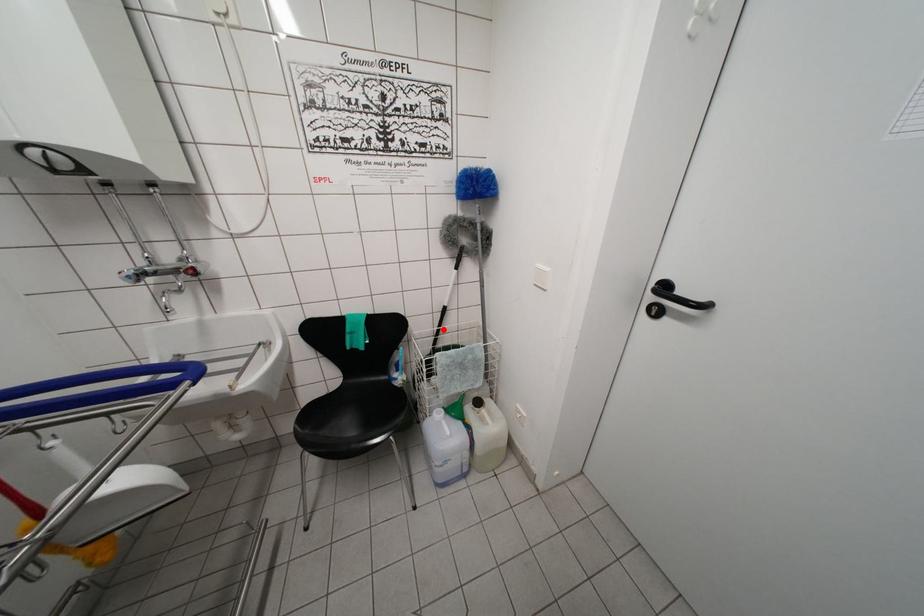
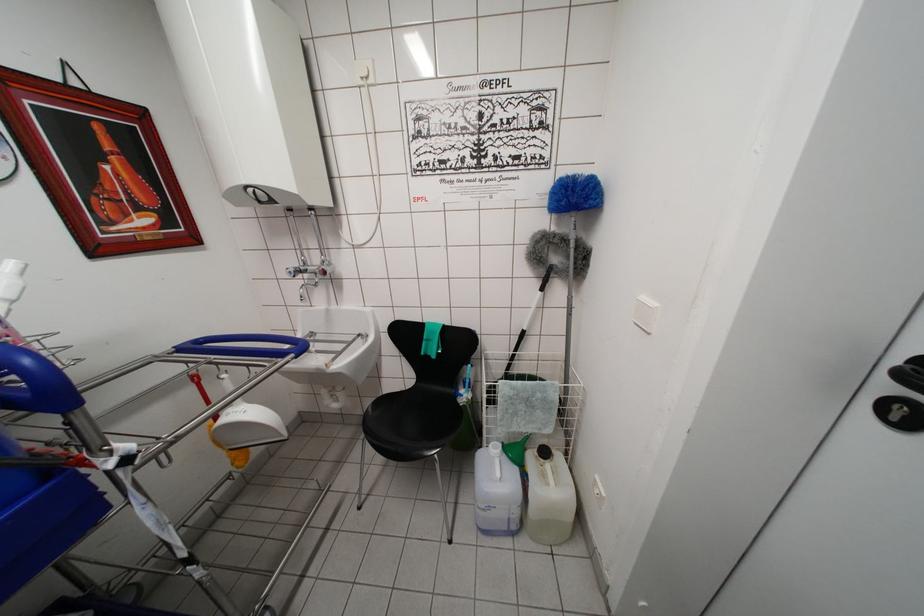
Where in the second image is the point corresponding to the highlighted location from the first image?

(518, 354)